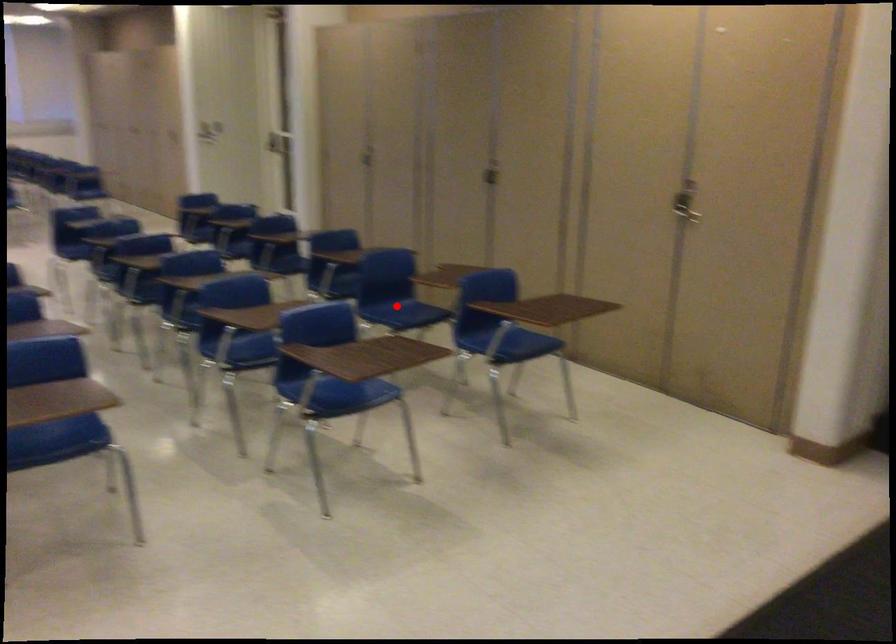
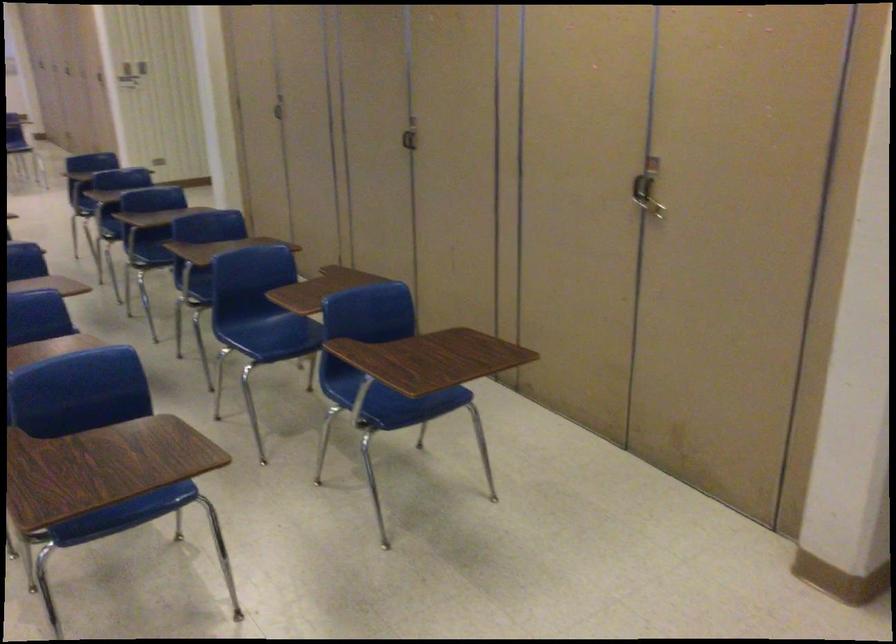
Locate, in the second image, the point that corresponds to the highlighted location in the first image.

(272, 328)